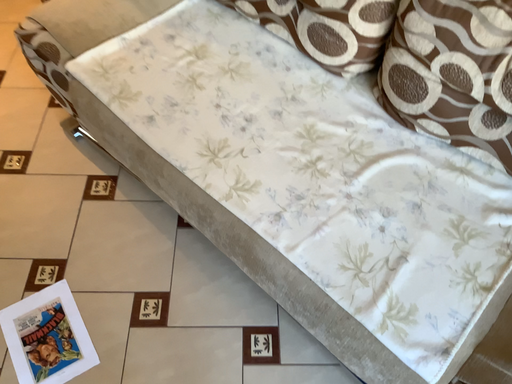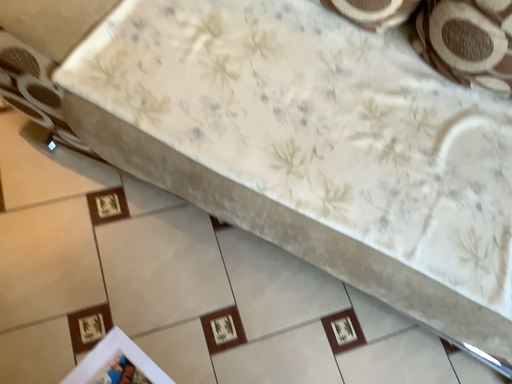
Question: Which way did the camera rotate in the video?

Choices:
 (A) rotated right
 (B) rotated left

Answer: (A)